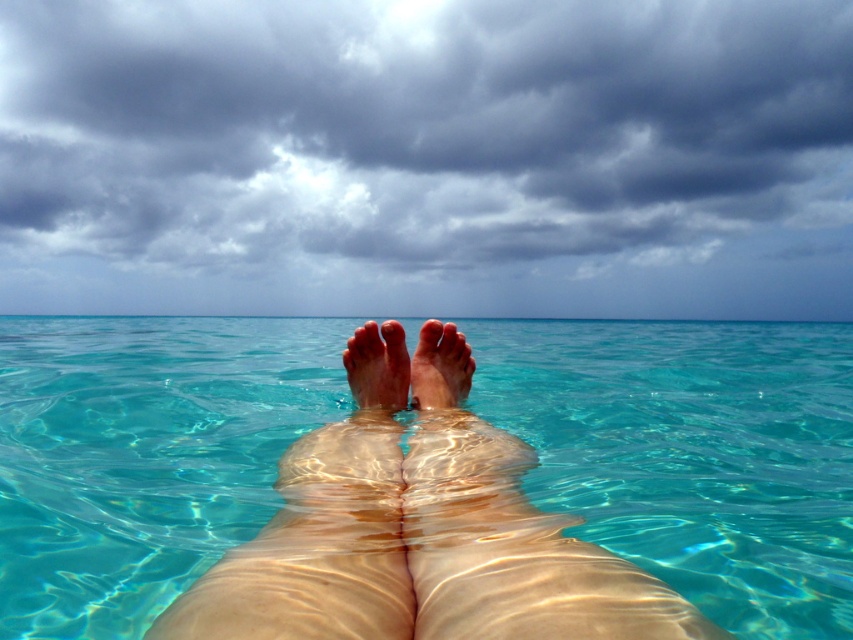
Question: Is cloudy sky at upper center bigger than smooth skin foot at center?

Choices:
 (A) no
 (B) yes

Answer: (B)

Question: Is cloudy sky at upper center smaller than smooth skin foot at center?

Choices:
 (A) no
 (B) yes

Answer: (A)

Question: Which of the following is the closest to the observer?

Choices:
 (A) (612, 618)
 (B) (444, 324)
 (C) (352, 339)
 (D) (378, 284)

Answer: (A)

Question: From the image, what is the correct spatial relationship of pale skin at center in relation to smooth skin legs at center?

Choices:
 (A) below
 (B) above

Answer: (B)

Question: Among these points, which one is nearest to the camera?

Choices:
 (A) (209, 122)
 (B) (439, 456)
 (C) (297, 337)
 (D) (402, 336)

Answer: (B)

Question: Among these points, which one is farthest from the camera?

Choices:
 (A) (241, 433)
 (B) (354, 376)
 (C) (90, 58)
 (D) (355, 336)

Answer: (C)